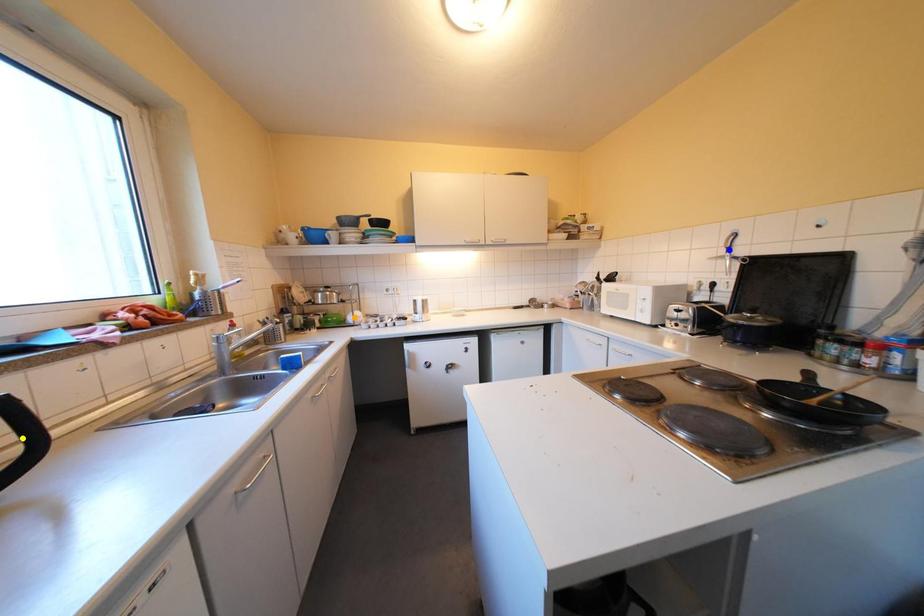
Order these from farthest to nearest:
yellow point
blue point
orange point

orange point < blue point < yellow point